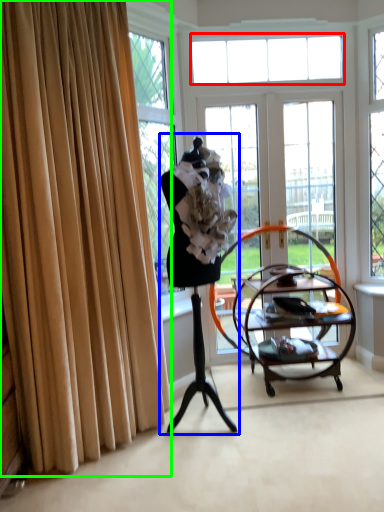
Question: Considering the real-world distances, which object is farthest from window (highlighted by a red box)? woman (highlighted by a blue box) or curtain (highlighted by a green box)?

Choices:
 (A) woman
 (B) curtain

Answer: (B)